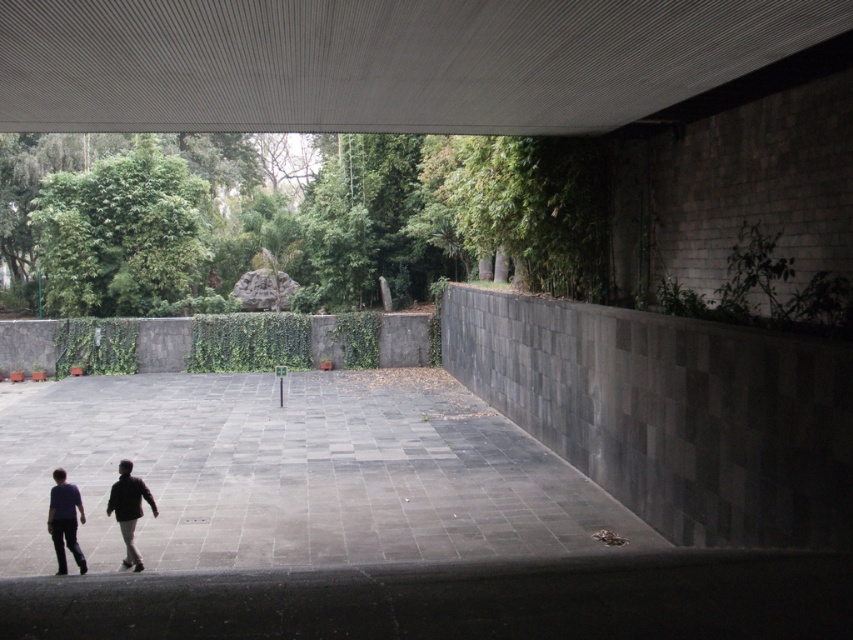
Question: Considering the real-world distances, which object is closest to the dark gray pants at lower left?

Choices:
 (A) smooth concrete ceiling at upper center
 (B) gray stone path at center

Answer: (B)

Question: Does dark gray pants at lower left have a greater width compared to dark blue jeans at lower left?

Choices:
 (A) no
 (B) yes

Answer: (A)

Question: Is dark blue jeans at lower left below dark brown leather jacket at lower left?

Choices:
 (A) yes
 (B) no

Answer: (A)

Question: Among these points, which one is nearest to the camera?

Choices:
 (A) (62, 547)
 (B) (20, 500)

Answer: (A)

Question: Can you confirm if gray stone path at center is wider than dark blue jeans at lower left?

Choices:
 (A) yes
 (B) no

Answer: (A)

Question: Estimate the real-world distances between objects in this image. Which object is farther from the gray stone path at center?

Choices:
 (A) dark gray pants at lower left
 (B) dark blue jeans at lower left

Answer: (B)